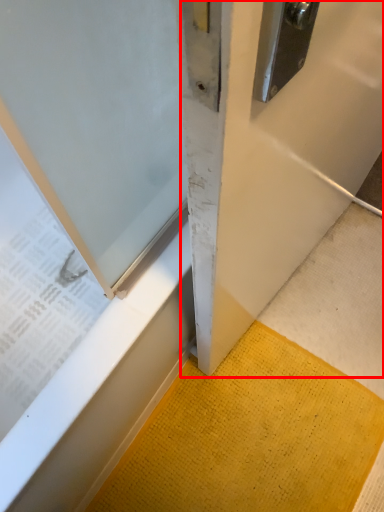
Question: Where is door (annotated by the red box) located in relation to doormat in the image?

Choices:
 (A) right
 (B) left

Answer: (A)